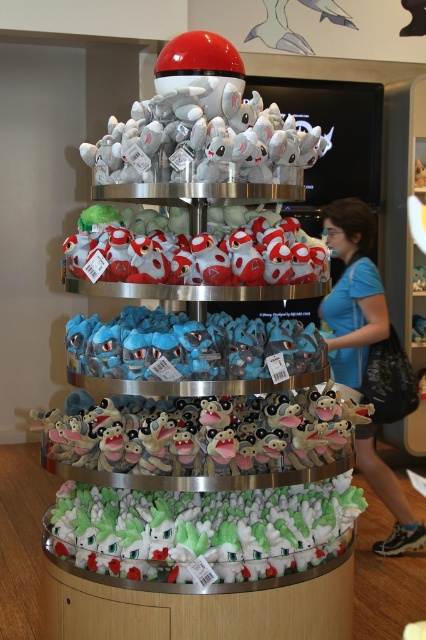
You are a customer browsing the display stand and want to pick up the white plush toys at center and the white soft plushies at bottom. Which one can you reach without moving your current position?

The white plush toys at center is closer to you than the white soft plushies at bottom, so you can reach the white plush toys at center without moving.

You are organizing the multi tiered display stand and need to place the white soft plushies at bottom and the soft plush toy at center. Which object takes up more space?

The soft plush toy at center takes up more space than the white soft plushies at bottom because the white soft plushies at bottom occupies less space than soft plush toy at center.

You are trying to place a new toy on the display stand. You have a small toy car that is 10 cm wide. The white soft plushies at bottom and the fluffy plush monkey at center are already on the stand. Which of these two areas has enough space to accommodate your toy car without overlapping?

The fluffy plush monkey at center has enough space because its width is greater than the white soft plushies at bottom, which is less than 10 cm. Since the toy car is 10 cm wide, the area around the fluffy plush monkey at center can fit it better.